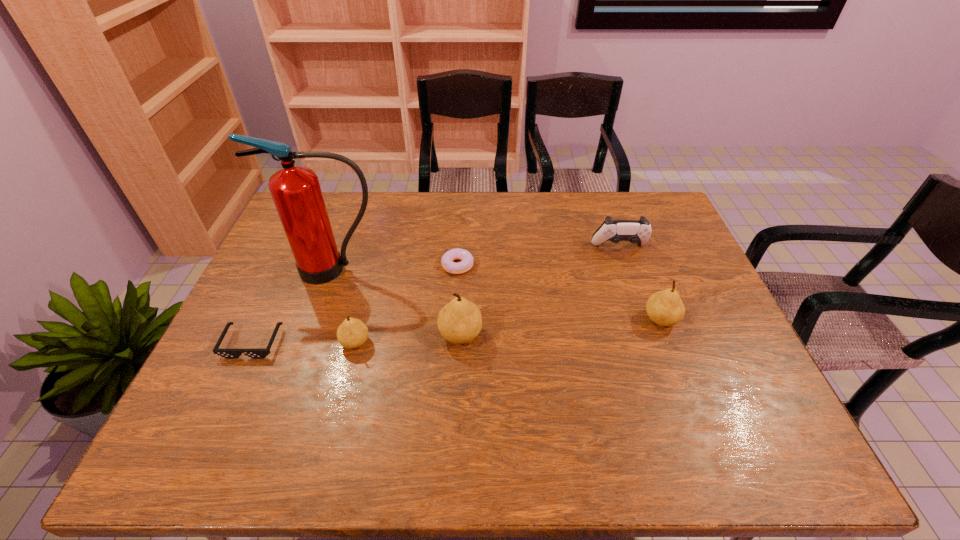
The image size is (960, 540). Identify the location of the leftmost pear. (352, 333).

Locate an element on the screen. The image size is (960, 540). the tallest pear is located at coordinates (460, 321).

This screenshot has height=540, width=960. In order to click on the second pear from right to left in this screenshot , I will do `click(460, 321)`.

Where is `the rightmost pear`? Image resolution: width=960 pixels, height=540 pixels. the rightmost pear is located at coordinates (665, 308).

Locate an element on the screen. This screenshot has height=540, width=960. the second shortest pear is located at coordinates (665, 308).

Identify the location of fire extinguisher. (296, 191).

Where is `doughnut`? doughnut is located at coordinates (466, 264).

Where is `control`? The height and width of the screenshot is (540, 960). control is located at coordinates (639, 232).

Identify the location of sunglasses. This screenshot has height=540, width=960. (227, 353).

The width and height of the screenshot is (960, 540). Identify the location of vacant space situated 0.070m on the front of the shortest pear. (347, 378).